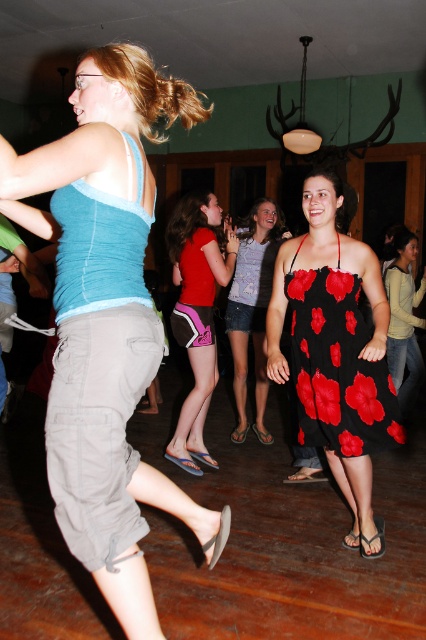
You are at a party and want to know which clothing item is more to the left between the matte blue tank top at center and the matte green sweater at center. Which one is it?

The matte blue tank top at center is positioned on the left side of the matte green sweater at center, so the matte blue tank top at center is more to the left.